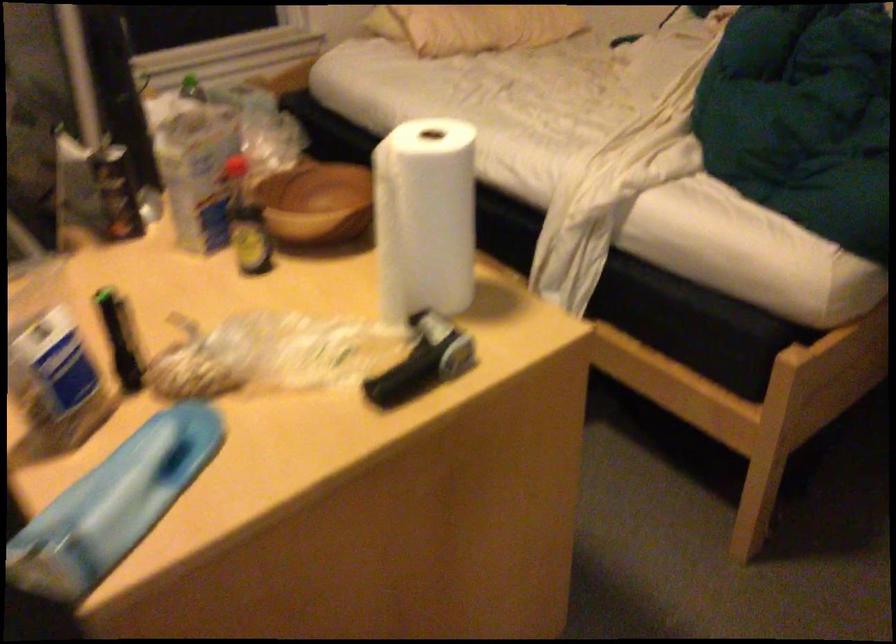
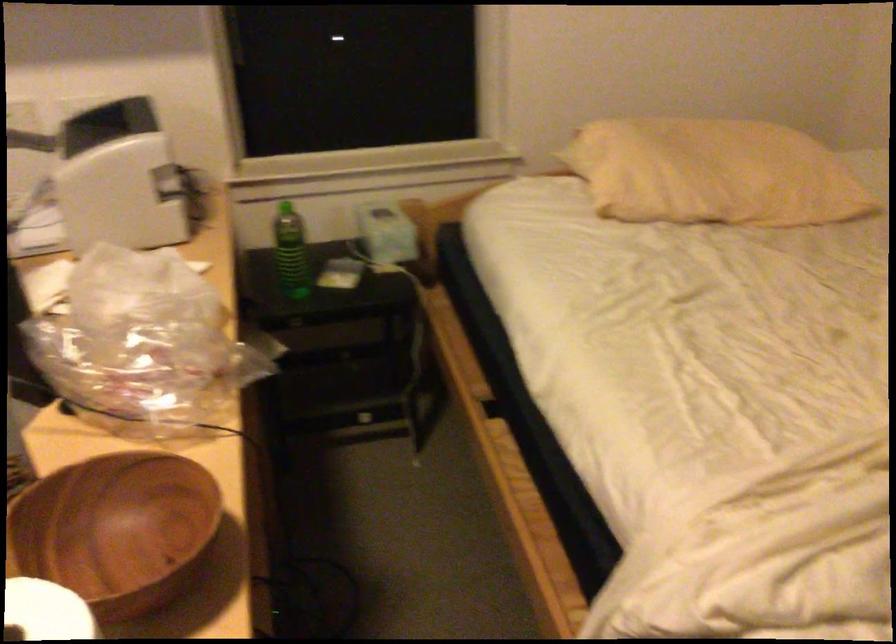
What movement of the cameraman would produce the second image?

The cameraman walked toward right, forward.